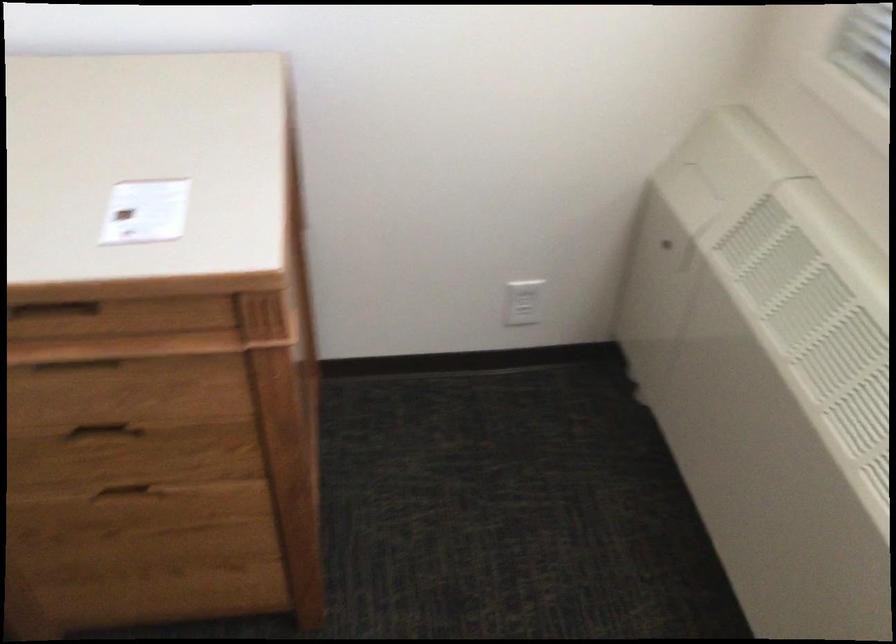
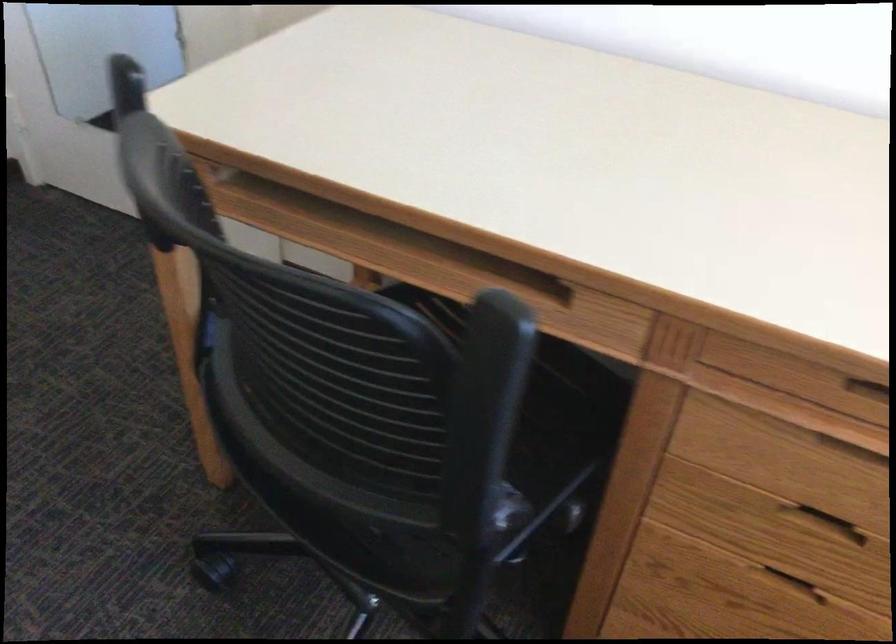
Question: The first image is from the beginning of the video and the second image is from the end. How did the camera likely rotate when shooting the video?

Choices:
 (A) Left
 (B) Right
 (C) Up
 (D) Down

Answer: (A)